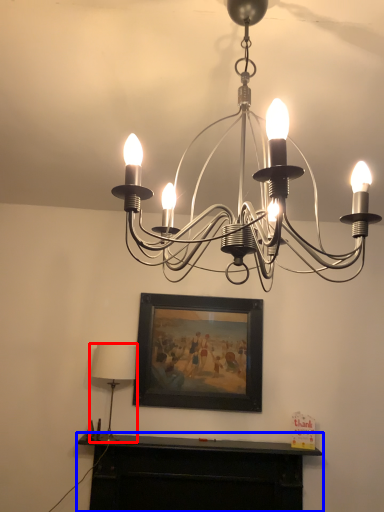
Question: Which point is closer to the camera, lamp (highlighted by a red box) or furniture (highlighted by a blue box)?

Choices:
 (A) lamp
 (B) furniture

Answer: (A)